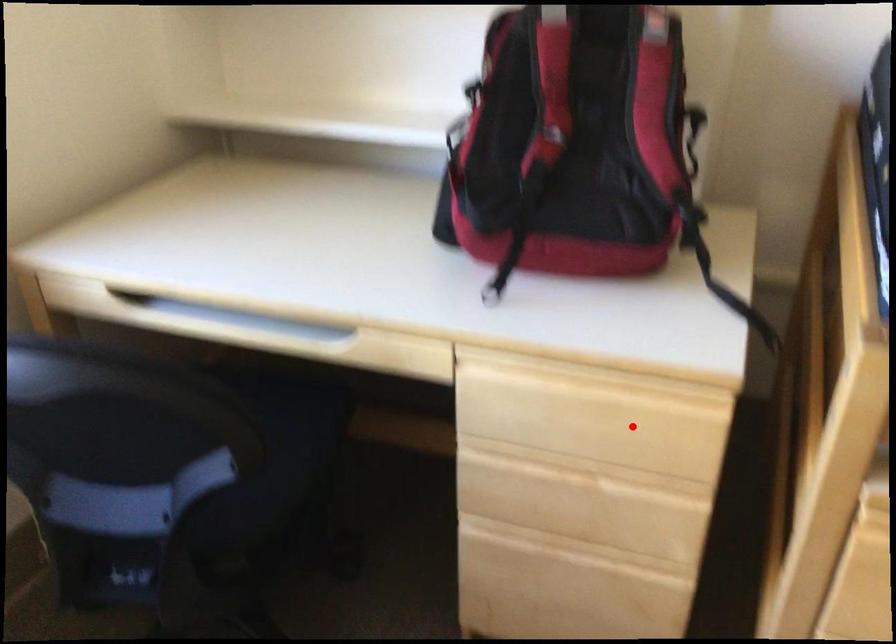
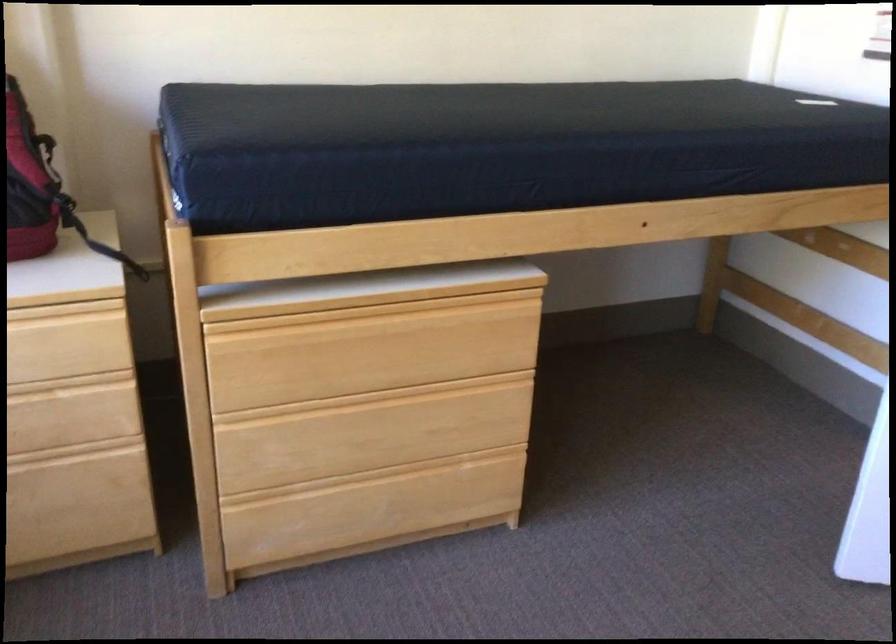
Question: I am providing you with two images of the same scene from different viewpoints. Given a red point in image1, look at the same physical point in image2. Is it:

Choices:
 (A) Closer to the viewpoint
 (B) Farther from the viewpoint

Answer: (B)